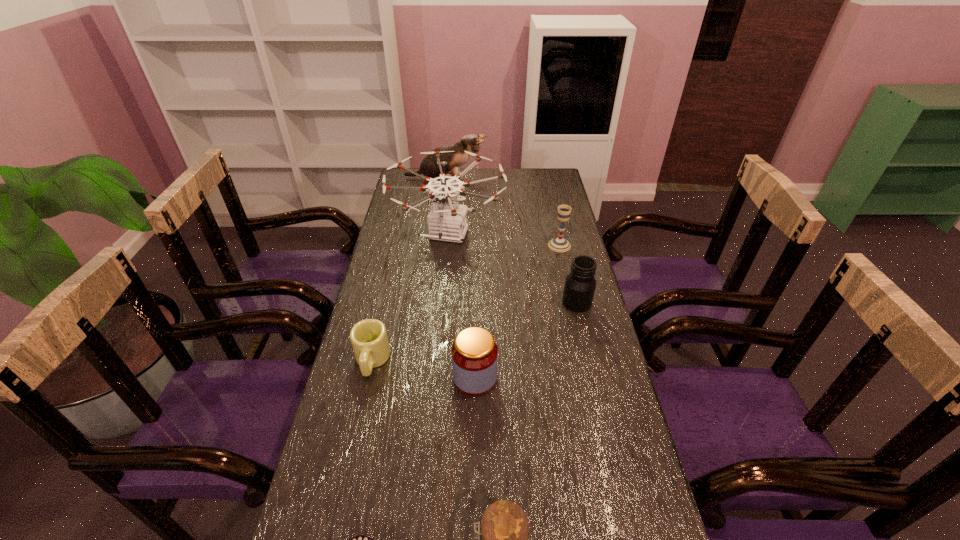
This screenshot has height=540, width=960. Identify the location of free point located on the back of the fourth farthest object. (571, 278).

What are the coordinates of `free location located on the left of the chalice` in the screenshot? It's located at (468, 245).

The width and height of the screenshot is (960, 540). I want to click on free space located 0.180m on the front of the second nearest jar, so click(474, 464).

Find the location of `vacant area located with the handle on the side of the seventh tallest object`. vacant area located with the handle on the side of the seventh tallest object is located at coordinates (335, 521).

This screenshot has height=540, width=960. I want to click on object that is positioned at the far edge, so click(471, 143).

Identify the location of drone positioned at the left edge. (447, 221).

You are a GUI agent. You are given a task and a screenshot of the screen. Output one action in this format:
    pyautogui.click(x=<x>, y=<y>)
    Task: Click on the cat located at the left edge
    Image resolution: width=960 pixels, height=540 pixels.
    Given the screenshot: What is the action you would take?
    pyautogui.click(x=471, y=143)

The width and height of the screenshot is (960, 540). What are the coordinates of `mug that is at the left edge` in the screenshot? It's located at (369, 340).

The height and width of the screenshot is (540, 960). What are the coordinates of `jar at the right edge` in the screenshot? It's located at (580, 284).

Where is `chalice positioned at the right edge`? chalice positioned at the right edge is located at coordinates (559, 244).